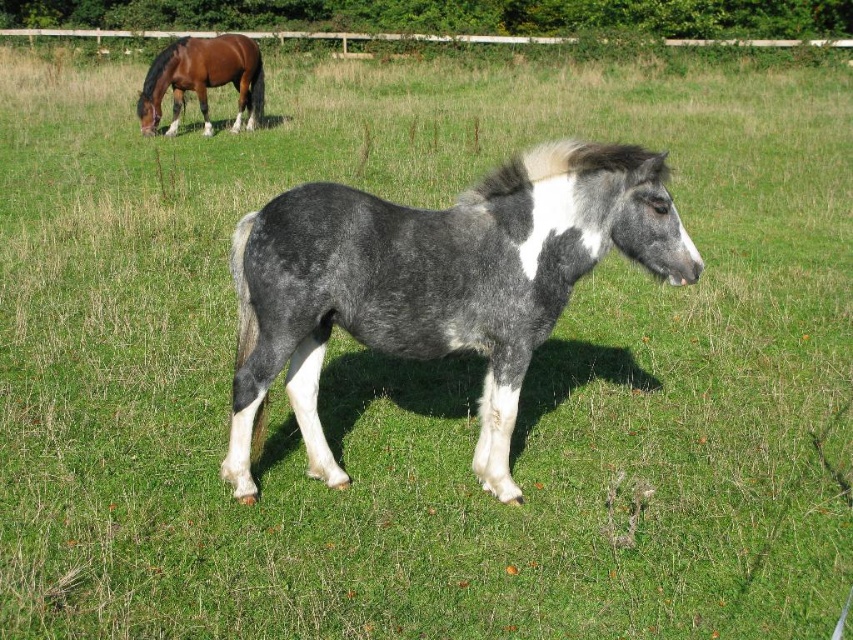
You are standing at the center of the field and see a point marked at coordinates point (x=202, y=80). What object is located at that point?

The point (x=202, y=80) is where the brown glossy horse at upper left is located.